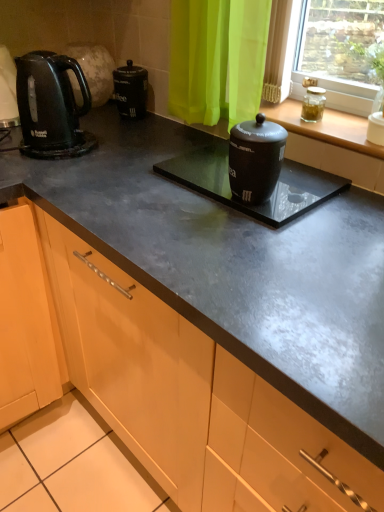
Identify the location of vacant space to the right of clear glass jar at upper right, the 2th appliance in the bottom-to-top sequence. The image size is (384, 512). (344, 117).